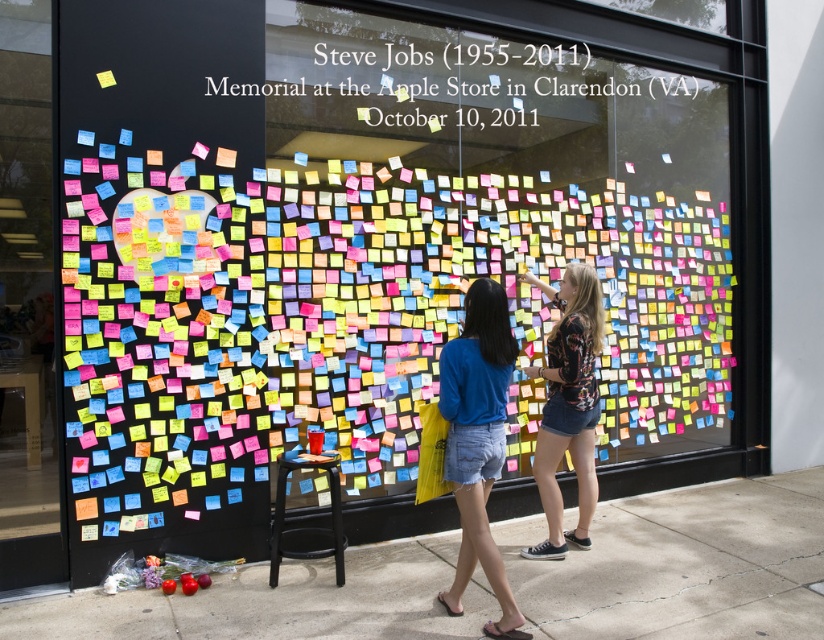
From the picture: Is black paper at upper center thinner than black matte stool at lower center?

Incorrect, black paper at upper center's width is not less than black matte stool at lower center's.

Is point (560, 106) in front of point (307, 552)?

That is False.

Locate an element on the screen. Image resolution: width=824 pixels, height=640 pixels. black paper at upper center is located at coordinates pyautogui.click(x=461, y=86).

Who is taller, black paper at upper center or denim shorts at center?

With more height is denim shorts at center.

Can you confirm if black paper at upper center is shorter than denim shorts at center?

Indeed, black paper at upper center has a lesser height compared to denim shorts at center.

Is point (457, 129) behind point (513, 355)?

Yes, it is.

Image resolution: width=824 pixels, height=640 pixels. Identify the location of black paper at upper center. (461, 86).

Does denim shorts at center lie behind floral print shirt at center?

No, it is in front of floral print shirt at center.

Between point (485, 304) and point (531, 280), which one is positioned behind?

Positioned behind is point (531, 280).

Identify the location of denim shorts at center. (478, 442).

I want to click on denim shorts at center, so click(x=478, y=442).